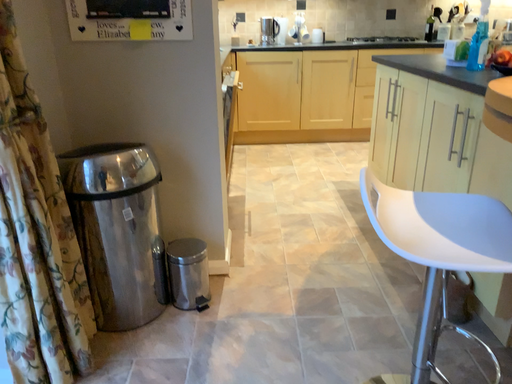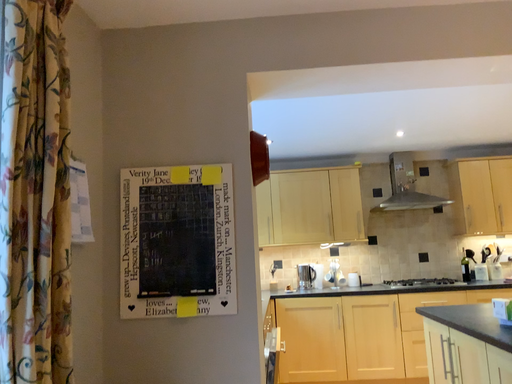
Question: How did the camera likely rotate when shooting the video?

Choices:
 (A) rotated downward
 (B) rotated upward

Answer: (B)